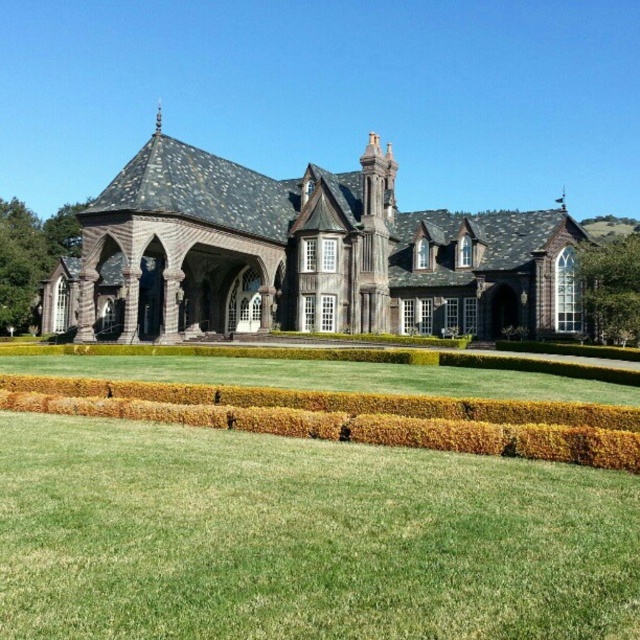
You are standing on the lawn in front of the mansion and see the wooden church at center and the green textured hedge at lower center. Which object is positioned higher relative to your viewpoint?

The wooden church at center is located above the green textured hedge at lower center, so it is positioned higher relative to your viewpoint.

You are a landscape architect planning to add a new pathway between the wooden church at center and the green textured hedge at lower center. Given their widths, which object will require more space on the pathway side?

The wooden church at center has a greater width than the green textured hedge at lower center, so it will require more space on the pathway side.